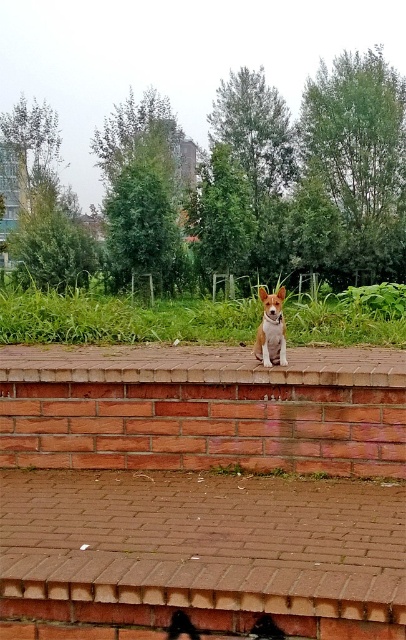
Question: Is brick at center bigger than brown fur dog at center?

Choices:
 (A) no
 (B) yes

Answer: (B)

Question: Is brick at center bigger than brown fur dog at center?

Choices:
 (A) yes
 (B) no

Answer: (A)

Question: Can you confirm if brick at center is bigger than brown fur dog at center?

Choices:
 (A) no
 (B) yes

Answer: (B)

Question: Among these objects, which one is nearest to the camera?

Choices:
 (A) brick at center
 (B) brown fur dog at center

Answer: (A)

Question: Which point is farther to the camera?

Choices:
 (A) brown fur dog at center
 (B) brick at center

Answer: (A)